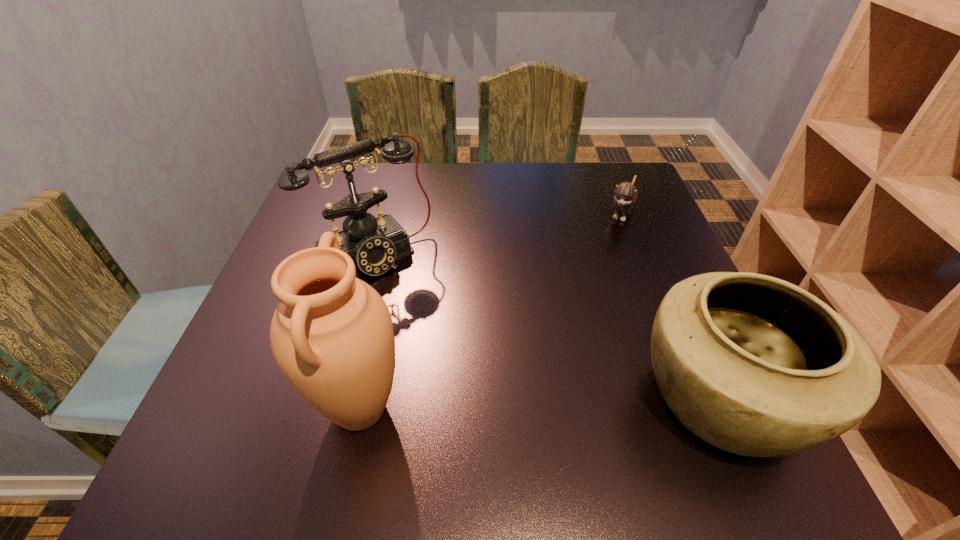
Identify the location of free region at the far edge of the desktop. Image resolution: width=960 pixels, height=540 pixels. (543, 197).

At what (x,y) coordinates should I click in order to perform the action: click on free location at the near edge of the desktop. Please return your answer as a coordinate pair (x, y). Looking at the image, I should click on (427, 412).

In order to click on vacant space at the right edge of the desktop in this screenshot , I will do `click(641, 369)`.

You are a GUI agent. You are given a task and a screenshot of the screen. Output one action in this format:
    pyautogui.click(x=<x>, y=<y>)
    Task: Click on the free spot at the far left corner of the desktop
    The height and width of the screenshot is (540, 960).
    Given the screenshot: What is the action you would take?
    pyautogui.click(x=311, y=205)

The image size is (960, 540). I want to click on vacant space at the far right corner of the desktop, so click(x=604, y=167).

Identify the location of free space that is in between the shortest object and the telephone. The image size is (960, 540). (497, 234).

Locate an element on the screen. vacant point located between the second shortest object and the second tallest object is located at coordinates (548, 326).

Identify the location of vacant area that lies between the second tallest object and the shortest object. (497, 234).

The width and height of the screenshot is (960, 540). I want to click on empty location between the urn and the second shortest object, so click(541, 403).

Locate an element on the screen. This screenshot has width=960, height=540. vacant point located between the pottery and the urn is located at coordinates (541, 403).